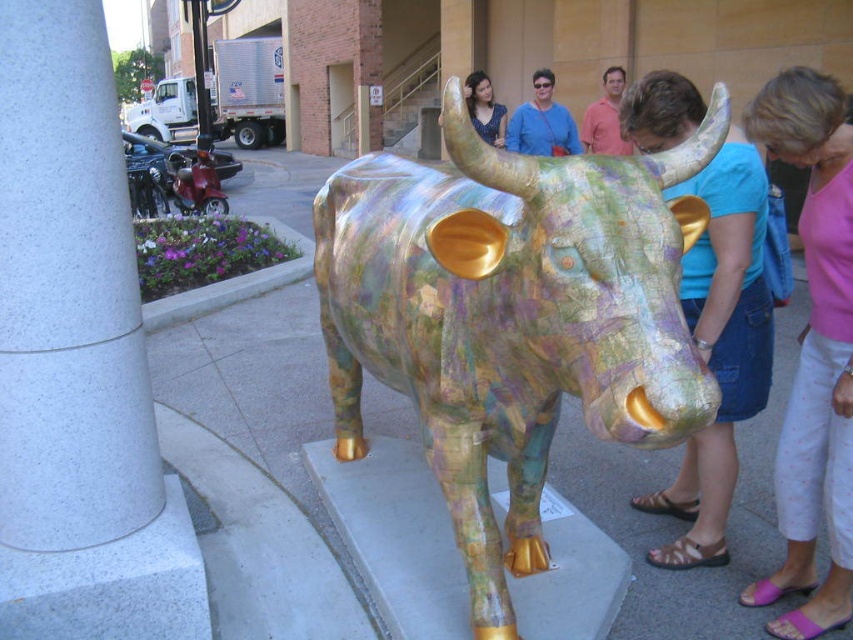
Question: Can you confirm if blue denim shorts at center is thinner than blue fabric purse at center?

Choices:
 (A) yes
 (B) no

Answer: (A)

Question: Is multicolored map paper bull at center to the right of blue denim shorts at center from the viewer's perspective?

Choices:
 (A) no
 (B) yes

Answer: (A)

Question: Which object is positioned farthest from the blue denim shorts at center?

Choices:
 (A) multicolored map paper bull at center
 (B) blue fabric purse at center
 (C) pink fabric pants at lower right

Answer: (B)

Question: Which of the following is the closest to the observer?

Choices:
 (A) blue fabric purse at center
 (B) multicolored map paper bull at center
 (C) blue denim shorts at center

Answer: (B)

Question: Which point is closer to the camera?

Choices:
 (A) multicolored map paper bull at center
 (B) pink fabric pants at lower right
 (C) blue fabric purse at center
 (D) blue denim shorts at center

Answer: (A)

Question: Is multicolored map paper bull at center wider than blue fabric purse at center?

Choices:
 (A) yes
 (B) no

Answer: (A)